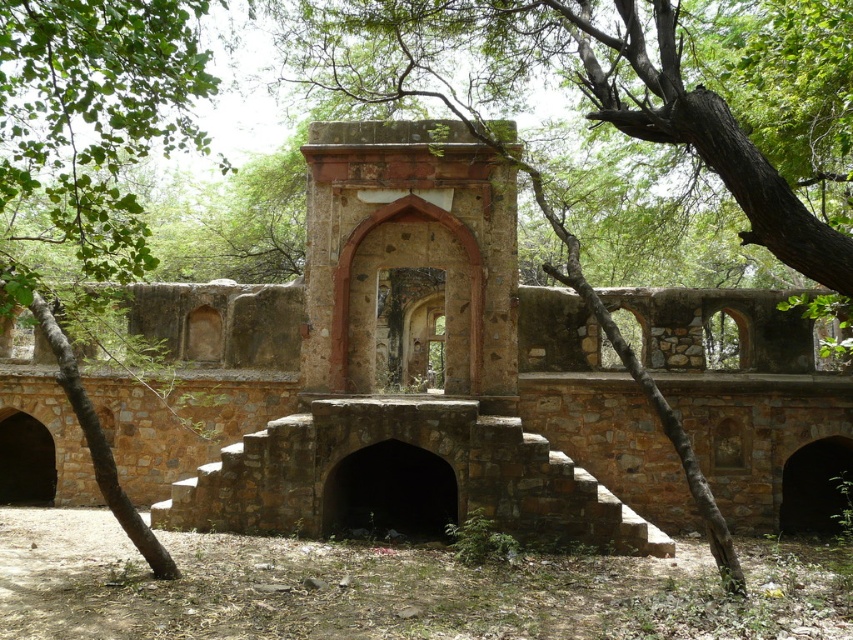
Does brown stone ruins at center come in front of brown rough stone arch at center?

No.

Between brown stone ruins at center and brown rough stone arch at center, which one is positioned higher?

brown rough stone arch at center is above.

Locate an element on the screen. Image resolution: width=853 pixels, height=640 pixels. brown stone ruins at center is located at coordinates (467, 380).

Where is `brown stone ruins at center`? The height and width of the screenshot is (640, 853). brown stone ruins at center is located at coordinates (467, 380).

You are a GUI agent. You are given a task and a screenshot of the screen. Output one action in this format:
    pyautogui.click(x=<x>, y=<y>)
    Task: Click on the brown rough stone arch at center
    
    Given the screenshot: What is the action you would take?
    pyautogui.click(x=573, y=83)

Is brown rough stone arch at center closer to camera compared to green leafy tree at left?

No, it is behind green leafy tree at left.

What do you see at coordinates (573, 83) in the screenshot? I see `brown rough stone arch at center` at bounding box center [573, 83].

Locate an element on the screen. Image resolution: width=853 pixels, height=640 pixels. brown rough stone arch at center is located at coordinates (573, 83).

Which of these two, brown stone ruins at center or green leafy tree at left, stands shorter?

With less height is brown stone ruins at center.

Is brown stone ruins at center positioned before green leafy tree at left?

No, brown stone ruins at center is behind green leafy tree at left.

Is point (347, 298) closer to viewer compared to point (76, 240)?

No, (347, 298) is further to viewer.

Find the location of a particular element. brown stone ruins at center is located at coordinates (467, 380).